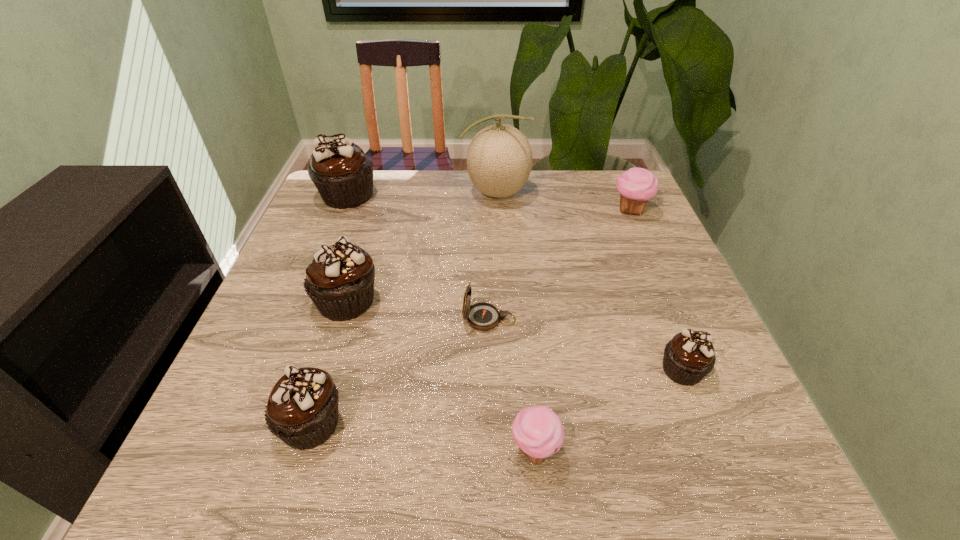
You are a GUI agent. You are given a task and a screenshot of the screen. Output one action in this format:
    pyautogui.click(x=<x>, y=<y>)
    Task: Click on the vacant space located 0.280m on the face of the compass
    This screenshot has height=540, width=960.
    Given the screenshot: What is the action you would take?
    pyautogui.click(x=327, y=319)

This screenshot has width=960, height=540. I want to click on blank area located on the front of the third nearest cupcake, so click(x=724, y=474).

Identify the location of free space located on the back of the third cupcake from right to left. (517, 268).

Where is `cantaloup present at the far edge`? Image resolution: width=960 pixels, height=540 pixels. cantaloup present at the far edge is located at coordinates (499, 160).

This screenshot has height=540, width=960. I want to click on object present at the far left corner, so click(x=343, y=175).

In order to click on object that is at the near left corner in this screenshot , I will do `click(302, 409)`.

This screenshot has height=540, width=960. In order to click on object at the far right corner in this screenshot , I will do `click(636, 186)`.

What are the coordinates of `vacant space at the far edge of the desktop` in the screenshot? It's located at (423, 170).

Locate an element on the screen. This screenshot has width=960, height=540. free space at the near edge of the desktop is located at coordinates [396, 463].

In order to click on free space at the left edge in this screenshot , I will do (x=312, y=249).